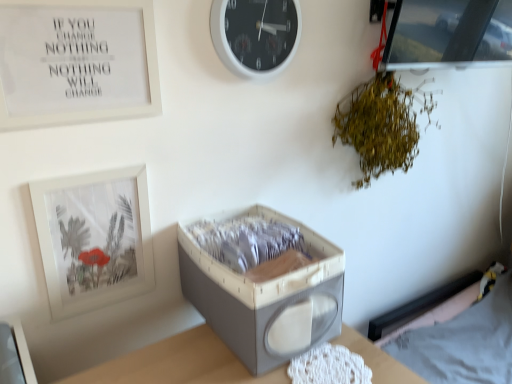
Question: Is transparent glass picture frame at upper right, the 1th picture frame positioned from the top, at the right side of white fabric hospital bed at lower right?

Choices:
 (A) no
 (B) yes

Answer: (A)

Question: Can you confirm if transparent glass picture frame at upper right, the first picture frame from the right, is wider than white fabric hospital bed at lower right?

Choices:
 (A) yes
 (B) no

Answer: (B)

Question: Is transparent glass picture frame at upper right, arranged as the 3th picture frame when viewed from the left, smaller than white fabric hospital bed at lower right?

Choices:
 (A) no
 (B) yes

Answer: (A)

Question: From the image's perspective, does transparent glass picture frame at upper right, the third picture frame positioned from the bottom, appear lower than white fabric hospital bed at lower right?

Choices:
 (A) yes
 (B) no

Answer: (B)

Question: Is white fabric hospital bed at lower right a part of transparent glass picture frame at upper right, arranged as the 3th picture frame when viewed from the left?

Choices:
 (A) yes
 (B) no

Answer: (B)

Question: Looking at the image, does transparent glass picture frame at upper right, the first picture frame from the right, seem bigger or smaller compared to white plastic wall clock at upper center?

Choices:
 (A) big
 (B) small

Answer: (A)

Question: Is transparent glass picture frame at upper right, the first picture frame from the right, wider or thinner than white plastic wall clock at upper center?

Choices:
 (A) wide
 (B) thin

Answer: (A)

Question: Is point click(445, 16) positioned closer to the camera than point click(263, 74)?

Choices:
 (A) farther
 (B) closer

Answer: (A)

Question: Which is correct: transparent glass picture frame at upper right, the 1th picture frame positioned from the top, is inside white plastic wall clock at upper center, or outside of it?

Choices:
 (A) inside
 (B) outside

Answer: (B)

Question: Is white matte picture frame at upper left, marked as the 1th picture frame in a bottom-to-top arrangement, taller or shorter than white fabric hospital bed at lower right?

Choices:
 (A) short
 (B) tall

Answer: (A)

Question: Considering the relative positions of white matte picture frame at upper left, positioned as the 3th picture frame in right-to-left order, and white fabric hospital bed at lower right in the image provided, is white matte picture frame at upper left, positioned as the 3th picture frame in right-to-left order, to the left or to the right of white fabric hospital bed at lower right?

Choices:
 (A) right
 (B) left

Answer: (B)

Question: Considering the positions of white matte picture frame at upper left, which is the 3th picture frame from top to bottom, and white fabric hospital bed at lower right in the image, is white matte picture frame at upper left, which is the 3th picture frame from top to bottom, wider or thinner than white fabric hospital bed at lower right?

Choices:
 (A) thin
 (B) wide

Answer: (A)

Question: Does point (96, 256) appear closer or farther from the camera than point (506, 357)?

Choices:
 (A) closer
 (B) farther

Answer: (A)

Question: Is green leafy plant at upper right wider or thinner than white plastic wall clock at upper center?

Choices:
 (A) thin
 (B) wide

Answer: (B)

Question: From the image's perspective, is green leafy plant at upper right positioned above or below white plastic wall clock at upper center?

Choices:
 (A) below
 (B) above

Answer: (A)